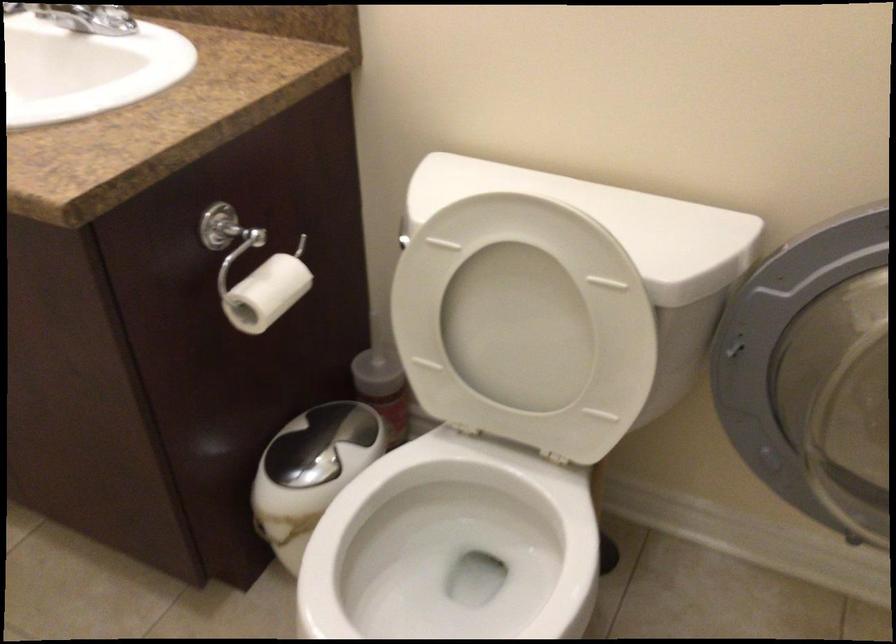
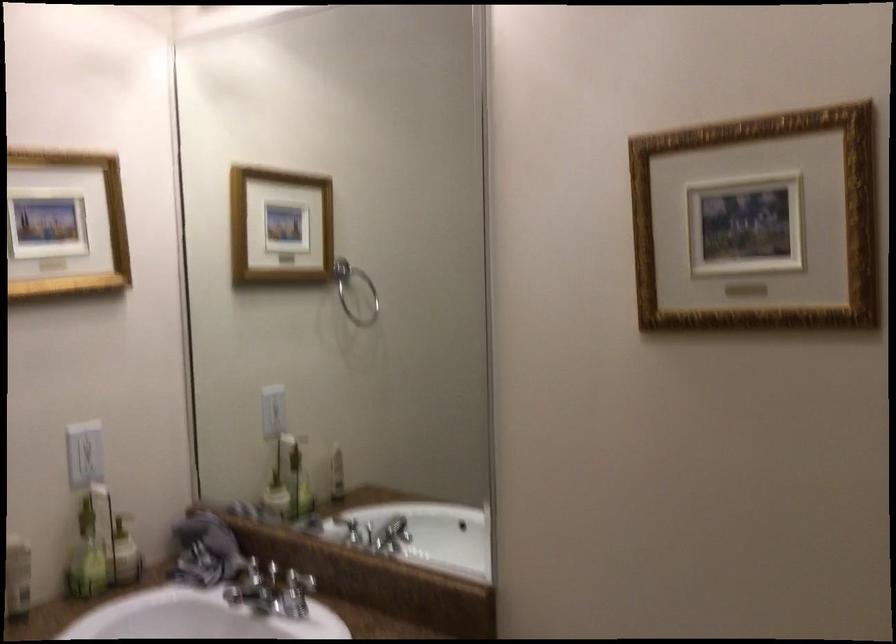
Question: Based on the continuous images, in which direction is the camera rotating? Reply with the corresponding letter.

Choices:
 (A) Left
 (B) Right
 (C) Up
 (D) Down

Answer: (C)